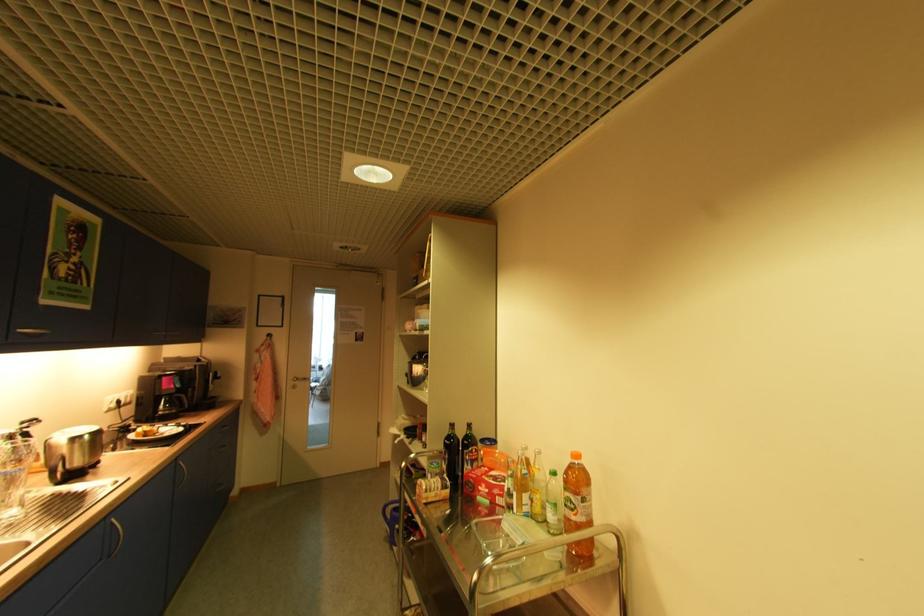
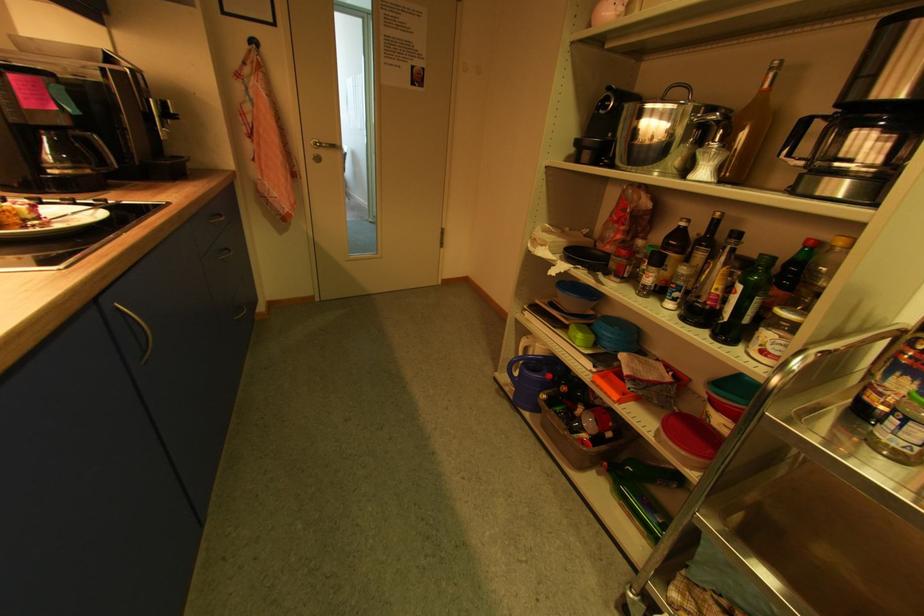
Question: I am providing you with two images of the same scene from different viewpoints. After the viewpoint changes to image2, which objects are now occluded?

Choices:
 (A) green glass bottle
 (B) tall glass bottle
 (C) blue cabinet handle
 (D) none of these

Answer: (D)